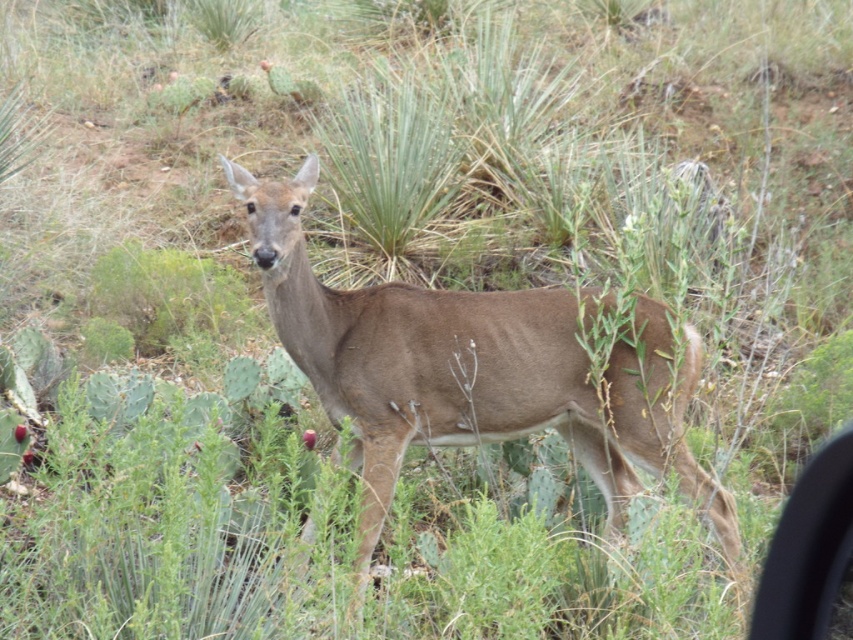
Who is taller, brown matte/deer at center or transparent plastic car window at lower right?

Standing taller between the two is brown matte/deer at center.

Is brown matte/deer at center positioned at the back of transparent plastic car window at lower right?

Yes, brown matte/deer at center is further from the viewer.

Measure the distance between brown matte/deer at center and camera.

A distance of 9.67 feet exists between brown matte/deer at center and camera.

This screenshot has width=853, height=640. I want to click on brown matte/deer at center, so click(473, 369).